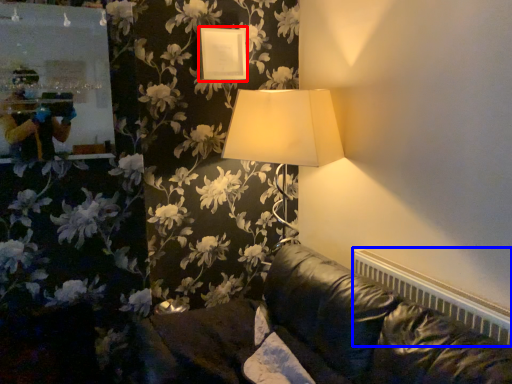
Question: Among these objects, which one is nearest to the camera, picture frame (highlighted by a red box) or radiator (highlighted by a blue box)?

Choices:
 (A) picture frame
 (B) radiator

Answer: (B)